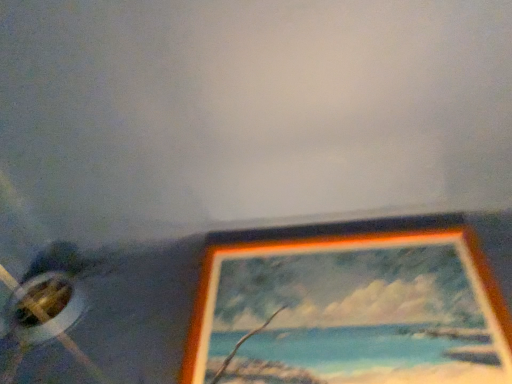
What do you see at coordinates (356, 304) in the screenshot? Image resolution: width=512 pixels, height=384 pixels. I see `wooden picture frame at lower right` at bounding box center [356, 304].

This screenshot has height=384, width=512. Identify the location of wooden picture frame at lower right. (356, 304).

You are a GUI agent. You are given a task and a screenshot of the screen. Output one action in this format:
    pyautogui.click(x=<x>, y=<y>)
    Task: Click on the wooden picture frame at lower right
    The width and height of the screenshot is (512, 384).
    Given the screenshot: What is the action you would take?
    pyautogui.click(x=356, y=304)